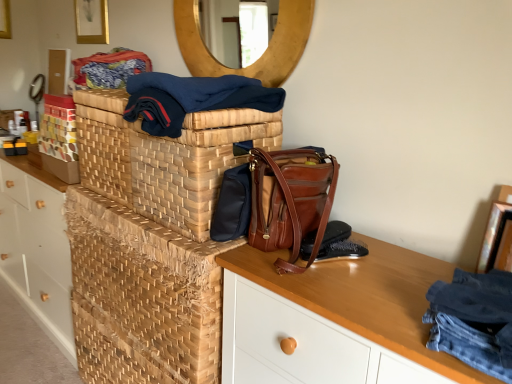
Describe the element at coordinates (192, 98) in the screenshot. The width and height of the screenshot is (512, 384). I see `navy blue fabric at upper center, which is counted as the second clothing, starting from the bottom` at that location.

Describe the element at coordinates (194, 165) in the screenshot. I see `woven brown basket at center` at that location.

Describe the element at coordinates (474, 320) in the screenshot. The height and width of the screenshot is (384, 512). I see `denim jeans at right, the first clothing viewed from the right` at that location.

Measure the distance between shiny brown leather messenger bag at center and camera.

1.10 meters.

Identify the location of wooden circular mirror at upper center. Image resolution: width=512 pixels, height=384 pixels. (260, 57).

Considering the sizes of objects wooden desk at center and black leather shoe at lower right, acting as the first shoe starting from the top, in the image provided, who is wider, wooden desk at center or black leather shoe at lower right, acting as the first shoe starting from the top,?

With larger width is wooden desk at center.

From the wooden desk at center, count the 2nd shoe to the left and point to it. Please provide its 2D coordinates.

[(335, 233)]

Are wooden desk at center and black leather shoe at lower right, acting as the first shoe starting from the top, beside each other?

No, wooden desk at center is not making contact with black leather shoe at lower right, acting as the first shoe starting from the top.

Between shiny brown leather messenger bag at center and denim jeans at right, the 2th clothing in the left-to-right sequence, which one is positioned in front?

denim jeans at right, the 2th clothing in the left-to-right sequence, is in front.

Does shiny brown leather messenger bag at center have a smaller size compared to denim jeans at right, the 2th clothing in the left-to-right sequence?

No, shiny brown leather messenger bag at center is not smaller than denim jeans at right, the 2th clothing in the left-to-right sequence.

Which object is wider, shiny brown leather messenger bag at center or denim jeans at right, the second clothing in the back-to-front sequence?

With larger width is shiny brown leather messenger bag at center.

From a real-world perspective, is shiny brown leather messenger bag at center above or below denim jeans at right, which is counted as the 1th clothing, starting from the bottom?

shiny brown leather messenger bag at center is situated higher than denim jeans at right, which is counted as the 1th clothing, starting from the bottom, in the real world.

Does point (223, 232) lie in front of point (155, 202)?

That is True.

Does shiny brown leather messenger bag at center have a greater height compared to woven brown basket at center?

In fact, shiny brown leather messenger bag at center may be shorter than woven brown basket at center.

How distant is shiny brown leather messenger bag at center from woven brown basket at center?

shiny brown leather messenger bag at center is 5.10 inches away from woven brown basket at center.

From the image's perspective, is shiny brown leather messenger bag at center located above or below woven brown basket at center?

shiny brown leather messenger bag at center is below woven brown basket at center.

Locate an element on the screen. This screenshot has width=512, height=384. crate that appears behind the brown leather shoe at center, which ranks as the 1th shoe in bottom-to-top order is located at coordinates (142, 296).

Which object is thinner, woven wood basket at center or brown leather shoe at center, the second shoe in the top-to-bottom sequence?

brown leather shoe at center, the second shoe in the top-to-bottom sequence, is thinner.

From the image's perspective, is woven wood basket at center positioned above or below brown leather shoe at center, the second shoe in the top-to-bottom sequence?

woven wood basket at center is situated lower than brown leather shoe at center, the second shoe in the top-to-bottom sequence, in the image.

Relative to brown leather shoe at center, the second shoe in the top-to-bottom sequence, is woven wood basket at center in front or behind?

Clearly, woven wood basket at center is behind brown leather shoe at center, the second shoe in the top-to-bottom sequence.

Is wooden circular mirror at upper center not inside wooden desk at center?

Yes, wooden circular mirror at upper center is located beyond the bounds of wooden desk at center.

This screenshot has width=512, height=384. In order to click on desk below the wooden circular mirror at upper center (from a real-world perspective) in this screenshot , I will do `click(365, 297)`.

Is wooden circular mirror at upper center in front of wooden desk at center?

No, the depth of wooden circular mirror at upper center is greater than that of wooden desk at center.

Which object is further away from the camera taking this photo, denim jeans at right, the first clothing viewed from the right, or navy blue fabric at upper center, which is counted as the second clothing, starting from the bottom?

navy blue fabric at upper center, which is counted as the second clothing, starting from the bottom, is further away from the camera.

From a real-world perspective, is denim jeans at right, which is the second clothing in top-to-bottom order, physically located above or below navy blue fabric at upper center, the 1th clothing from the left?

From a real-world perspective, denim jeans at right, which is the second clothing in top-to-bottom order, is physically below navy blue fabric at upper center, the 1th clothing from the left.

From the image's perspective, is denim jeans at right, the second clothing in the back-to-front sequence, beneath navy blue fabric at upper center, the second clothing when ordered from right to left?

Correct, denim jeans at right, the second clothing in the back-to-front sequence, appears lower than navy blue fabric at upper center, the second clothing when ordered from right to left, in the image.

Considering the positions of point (279, 89) and point (352, 268), is point (279, 89) closer or farther from the camera than point (352, 268)?

Point (279, 89).

How different are the orientations of navy blue fabric at upper center, the 2th clothing in the front-to-back sequence, and wooden desk at center in degrees?

There is a 3.36-degree angle between the facing directions of navy blue fabric at upper center, the 2th clothing in the front-to-back sequence, and wooden desk at center.

Would you say wooden desk at center is part of navy blue fabric at upper center, the 2th clothing in the front-to-back sequence,'s contents?

No.

In terms of width, does navy blue fabric at upper center, the 1th clothing viewed from the top, look wider or thinner when compared to wooden desk at center?

In the image, navy blue fabric at upper center, the 1th clothing viewed from the top, appears to be more narrow than wooden desk at center.

Which shoe is the 2nd one when counting from the left side of the wooden desk at center? Please provide its 2D coordinates.

[(335, 233)]

The height and width of the screenshot is (384, 512). In order to click on messenger bag lying above the denim jeans at right, which is counted as the 1th clothing, starting from the bottom (from the image's perspective) in this screenshot , I will do `click(232, 205)`.

Estimate the real-world distances between objects in this image. Which object is closer to denim jeans at right, the first clothing viewed from the right, shiny brown leather messenger bag at center or wooden desk at center?

wooden desk at center is closer to denim jeans at right, the first clothing viewed from the right.

Based on their spatial positions, is woven wood basket at center or denim jeans at right, the 2th clothing in the left-to-right sequence, further from navy blue fabric at upper center, the 1th clothing viewed from the top?

denim jeans at right, the 2th clothing in the left-to-right sequence, is positioned further to the anchor navy blue fabric at upper center, the 1th clothing viewed from the top.

Looking at this image, which object lies nearer to the anchor point black leather shoe at lower right, acting as the first shoe starting from the top, woven brown basket at center or wooden desk at center?

wooden desk at center is closer to black leather shoe at lower right, acting as the first shoe starting from the top.

Which object lies nearer to the anchor point woven wood basket at center, woven brown basket at center or black leather shoe at lower right, acting as the first shoe starting from the top?

The object closer to woven wood basket at center is woven brown basket at center.

Considering their positions, is brown leather shoe at center, which ranks as the 1th shoe in bottom-to-top order, positioned further to black leather shoe at lower right, acting as the first shoe starting from the top, than textured woven fabric at upper left?

textured woven fabric at upper left.

Considering their positions, is brown leather shoe at center, which ranks as the 1th shoe in bottom-to-top order, positioned closer to woven wood basket at center than wooden desk at center?

The object closer to woven wood basket at center is wooden desk at center.

Which object lies further to the anchor point brown leather shoe at center, which ranks as the 1th shoe in bottom-to-top order, denim jeans at right, which is counted as the 1th clothing, starting from the bottom, or woven wood basket at center?

Based on the image, woven wood basket at center appears to be further to brown leather shoe at center, which ranks as the 1th shoe in bottom-to-top order.

Estimate the real-world distances between objects in this image. Which object is closer to shiny brown leather messenger bag at center, textured woven fabric at upper left or black leather shoe at lower right, acting as the first shoe starting from the top?

Based on the image, black leather shoe at lower right, acting as the first shoe starting from the top, appears to be nearer to shiny brown leather messenger bag at center.

Where is `shoe between woven brown basket at center and brown leather shoe at center, which ranks as the 1th shoe in bottom-to-top order, from left to right`? This screenshot has width=512, height=384. shoe between woven brown basket at center and brown leather shoe at center, which ranks as the 1th shoe in bottom-to-top order, from left to right is located at coordinates (335, 233).

Find the location of a particular element. Image resolution: width=512 pixels, height=384 pixels. messenger bag between wooden circular mirror at upper center and wooden desk at center in the vertical direction is located at coordinates point(232,205).

Where is `messenger bag between navy blue fabric at upper center, the 1th clothing from the left, and woven wood basket at center vertically`? Image resolution: width=512 pixels, height=384 pixels. messenger bag between navy blue fabric at upper center, the 1th clothing from the left, and woven wood basket at center vertically is located at coordinates (232, 205).

This screenshot has width=512, height=384. Identify the location of clothing between shiny brown leather messenger bag at center and wooden desk at center vertically. (474, 320).